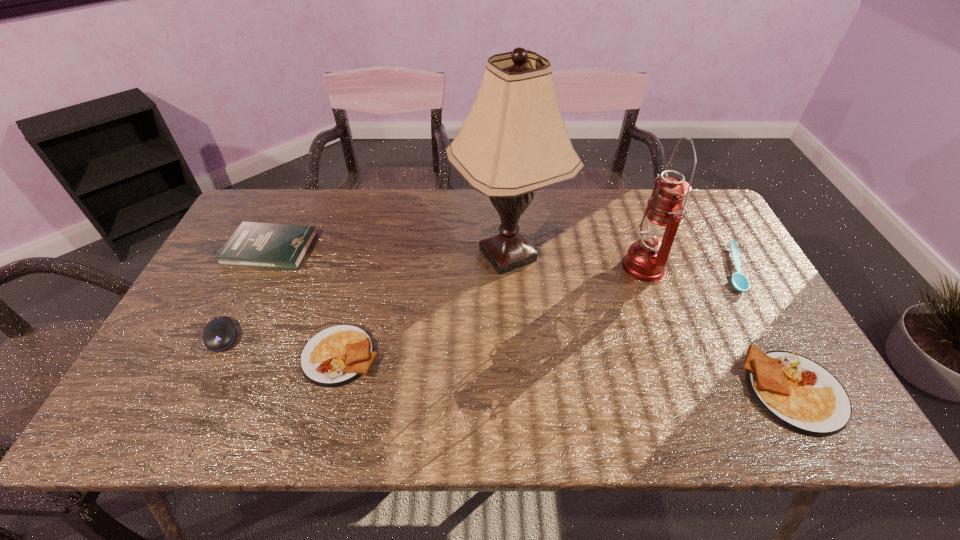
This screenshot has height=540, width=960. What are the coordinates of `free space between the shortest object and the computer mouse` in the screenshot? It's located at (478, 302).

Where is `the fifth closest object relative to the sixth shortest object`? This screenshot has width=960, height=540. the fifth closest object relative to the sixth shortest object is located at coordinates (262, 245).

Choose which object is the sixth nearest neighbor to the spoon. Please provide its 2D coordinates. Your answer should be formatted as a tuple, i.e. [(x, y)], where the tuple contains the x and y coordinates of a point satisfying the conditions above.

[(219, 333)]

This screenshot has width=960, height=540. In order to click on vacant position in the image that satisfies the following two spatial constraints: 1. on the back side of the fourth object from left to right; 2. on the right side of the shorter omelet in this screenshot , I will do `click(367, 254)`.